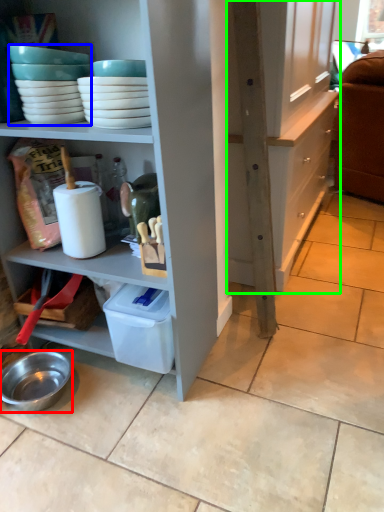
Question: Based on their relative distances, which object is farther from bowl (highlighted by a red box)? Choose from tableware (highlighted by a blue box) and cabinetry (highlighted by a green box).

Choices:
 (A) tableware
 (B) cabinetry

Answer: (B)